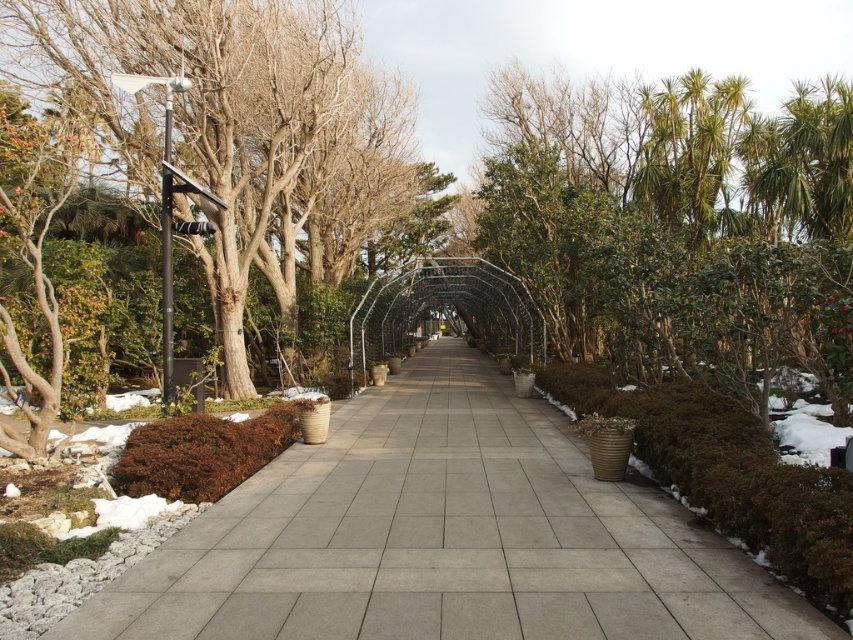
You are standing on the gray concrete pavement at center and want to walk towards the brown bark tree at left. Is the tree in front of or behind you?

The brown bark tree at left is behind you because the gray concrete pavement at center is closer to the viewer than the brown bark tree at left, meaning you are facing away from the tree.

You are standing on the brown matte bush at lower left and want to step onto the gray concrete pavement at center. In which direction should you move?

You should move to the right to reach the gray concrete pavement at center since it is located to the right of the brown matte bush at lower left.

You are a landscape architect designing a garden and want to place a small statue between the green leafy tree at center and the brown matte bush at lower left. Which object should the statue be closer to if you want it to appear balanced in height with both?

The statue should be placed closer to the brown matte bush at lower left because the green leafy tree at center is much taller, so positioning it nearer to the shorter bush will create a balanced visual height between the two objects.